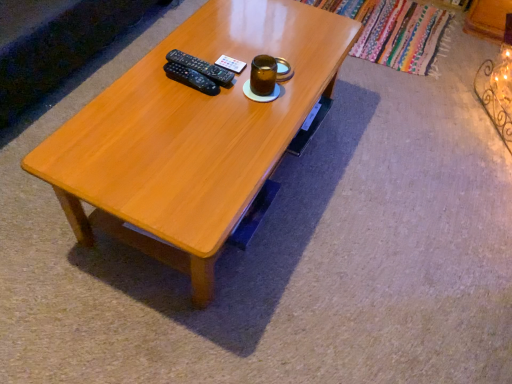
Find the location of `unoccupied space behind black plastic remote at center`. unoccupied space behind black plastic remote at center is located at coordinates (208, 45).